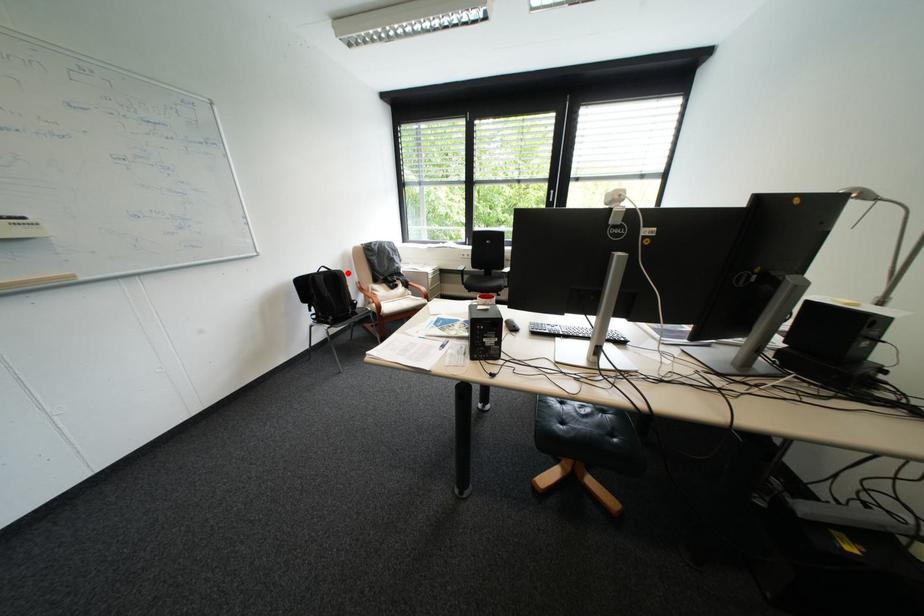
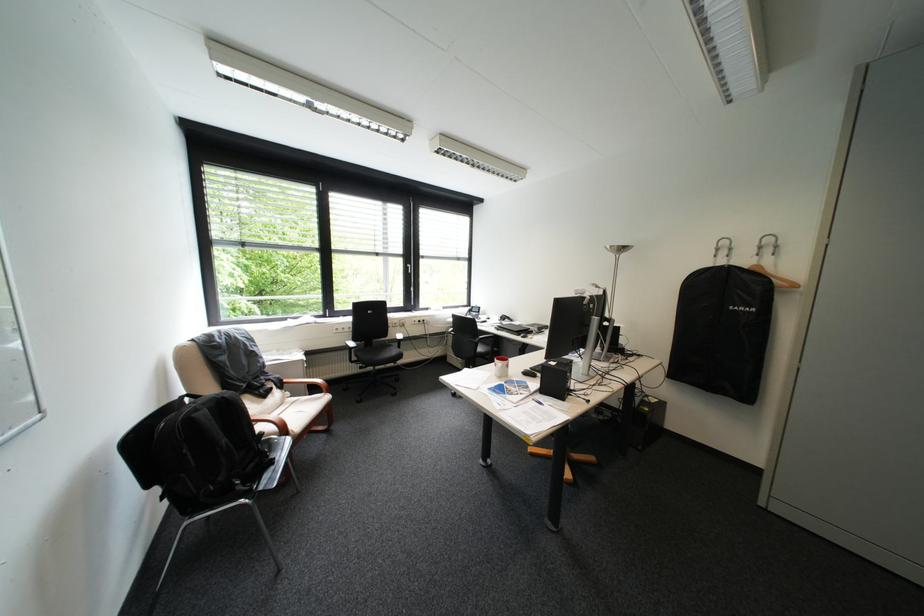
Question: I am providing you with two images of the same scene from different viewpoints. A red point is shown in image1. For the corresponding object point in image2, is it positioned nearer or farther from the camera?

Choices:
 (A) Nearer
 (B) Farther

Answer: (A)